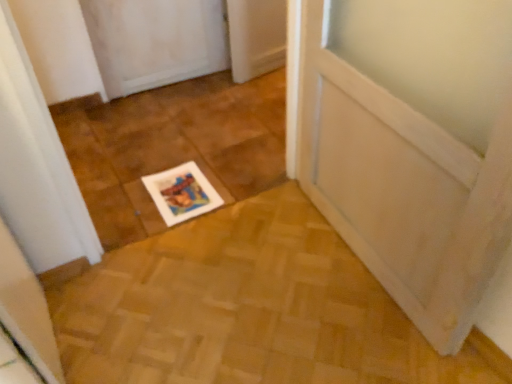
I want to click on free space above white paper at center (from a real-world perspective), so click(x=177, y=185).